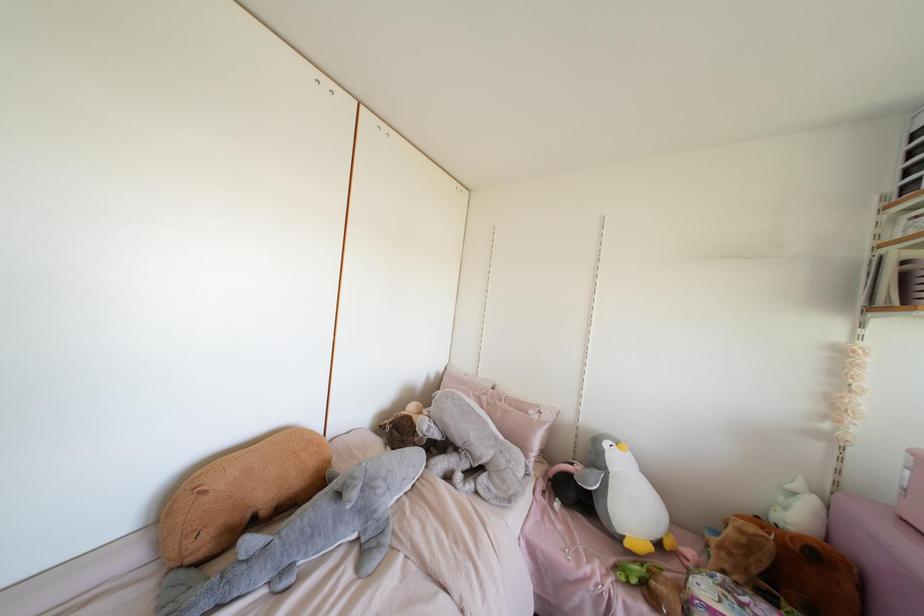
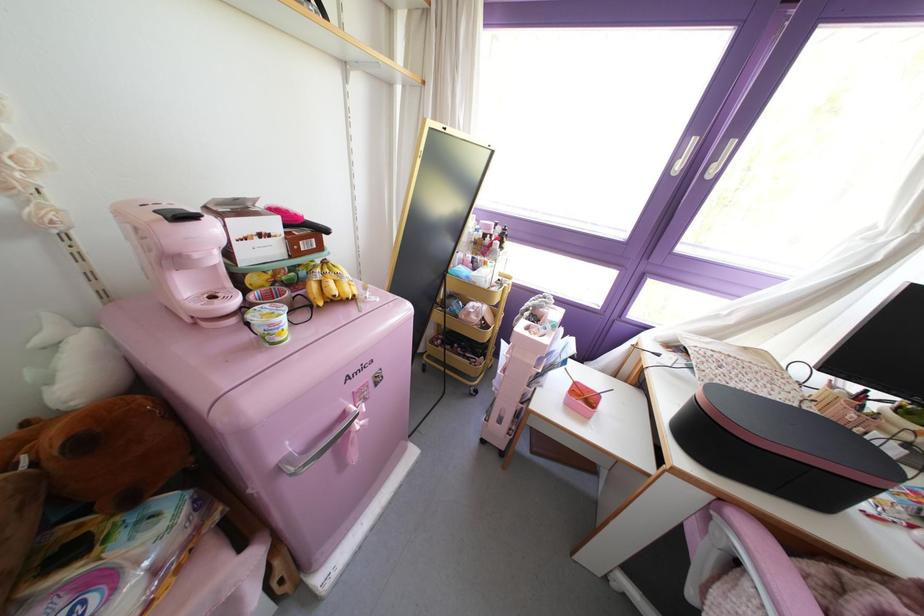
How did the camera likely rotate?

The camera rotated toward right-down.